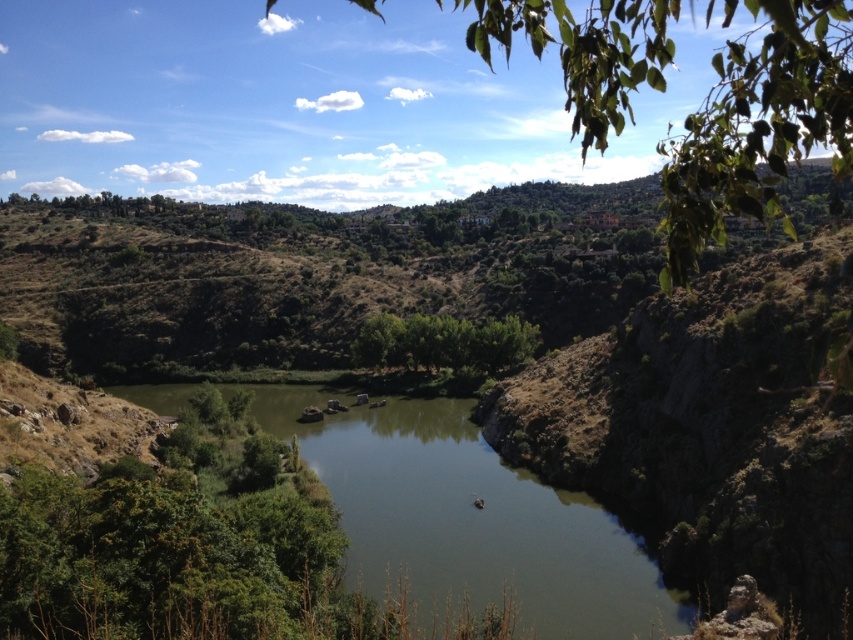
Question: Can you confirm if greenish water at center is wider than green leafy tree at upper center?

Choices:
 (A) yes
 (B) no

Answer: (B)

Question: Does green leafy tree at upper center have a larger size compared to green leafy trees at center?

Choices:
 (A) yes
 (B) no

Answer: (A)

Question: Which object appears closest to the camera in this image?

Choices:
 (A) greenish water at center
 (B) green leafy tree at upper center
 (C) green leafy trees at center

Answer: (B)

Question: Does green leafy tree at upper center lie in front of green leafy trees at center?

Choices:
 (A) yes
 (B) no

Answer: (A)

Question: Which of the following is the farthest from the observer?

Choices:
 (A) (584, 17)
 (B) (381, 330)
 (C) (469, 435)

Answer: (A)

Question: Among these points, which one is farthest from the camera?

Choices:
 (A) (683, 234)
 (B) (419, 365)
 (C) (352, 449)

Answer: (B)